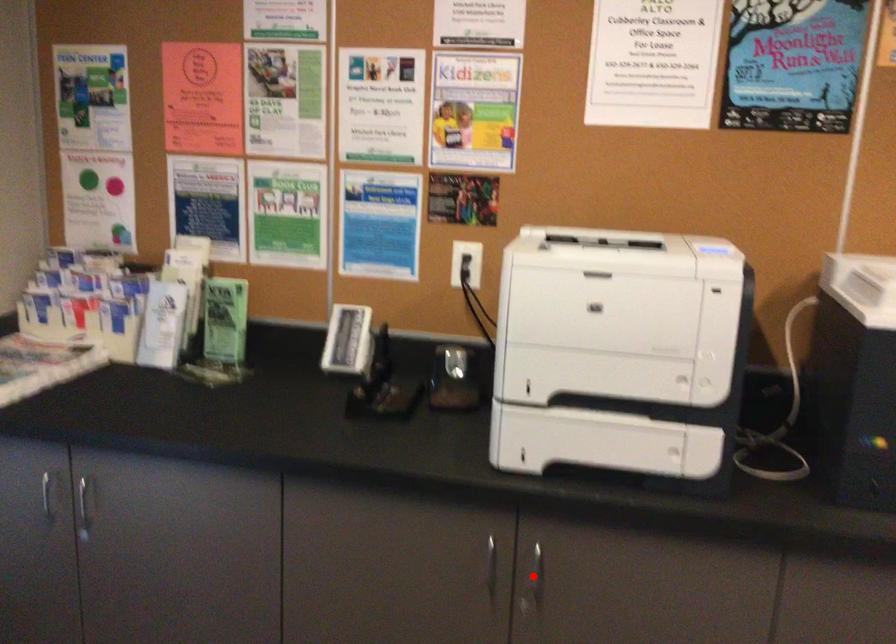
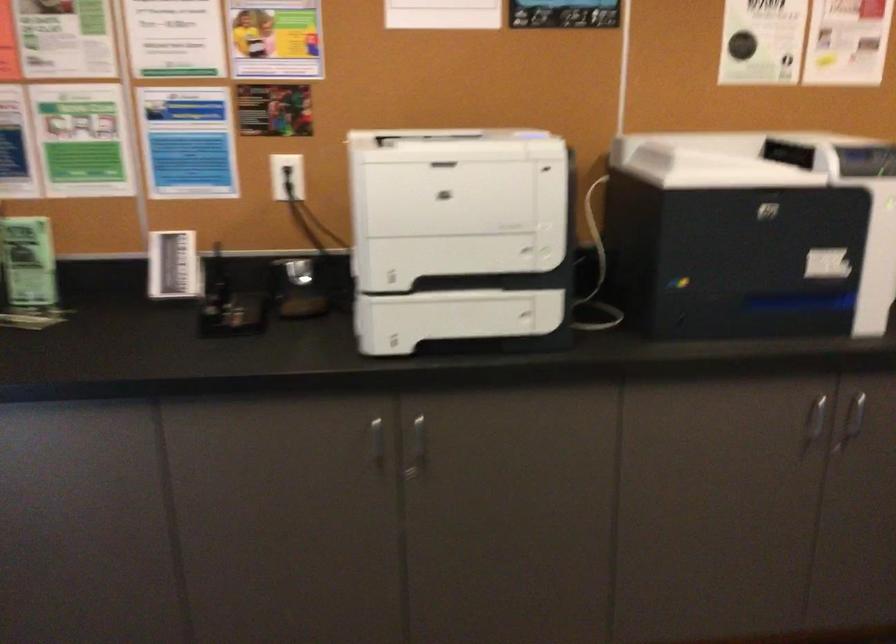
The point at the highlighted location is marked in the first image. Where is the corresponding point in the second image?

(417, 448)